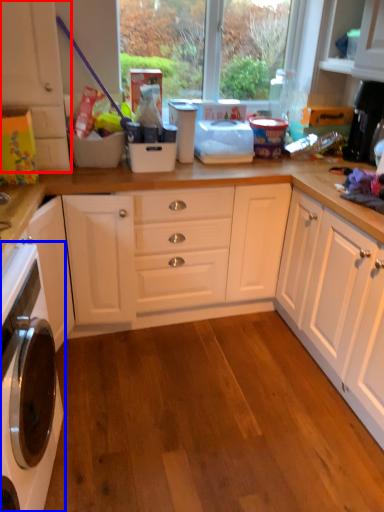
Question: Which object is further to the camera taking this photo, cabinetry (highlighted by a red box) or home appliance (highlighted by a blue box)?

Choices:
 (A) cabinetry
 (B) home appliance

Answer: (A)